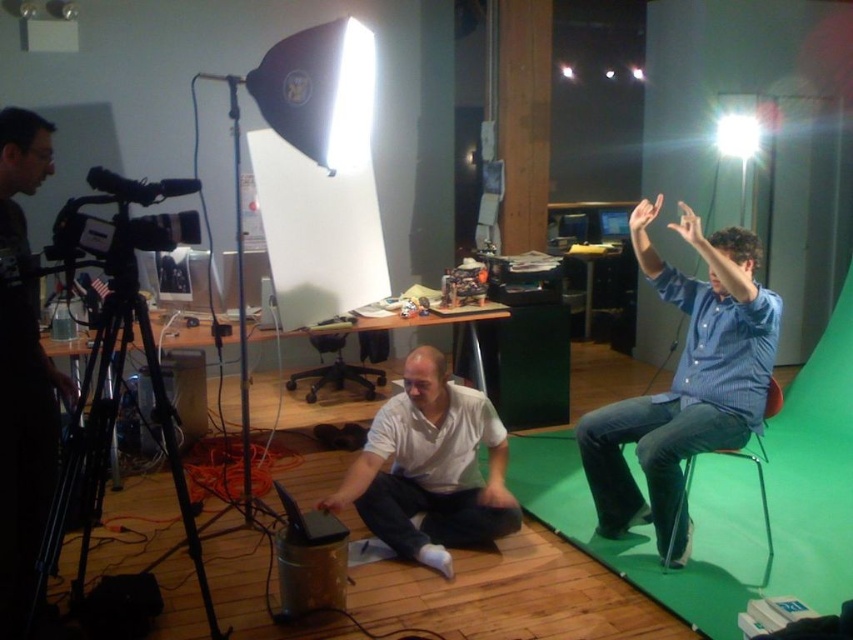
You are a camera operator in the studio. You need to adjust your focus so that both the blue striped shirt at right and the white matte laptop at center are in clear view. Given their relative heights, which object should you focus on first to ensure proper framing?

The blue striped shirt at right has a greater height compared to the white matte laptop at center, so you should focus on the blue striped shirt at right first to ensure proper framing.

You are a director observing the video production setup. You need to adjust the lighting so that the blue striped shirt at right and the black matte camera at left are both well lit. Which object should you move closer to the light source first?

The blue striped shirt at right is closer to the viewer than the black matte camera at left, so you should move the black matte camera at left closer to the light source first to ensure both are well lit.